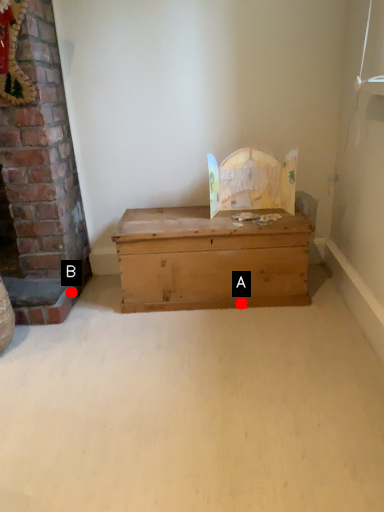
Question: Two points are circled on the image, labeled by A and B beside each circle. Which point is closer to the camera taking this photo?

Choices:
 (A) A is closer
 (B) B is closer

Answer: (A)